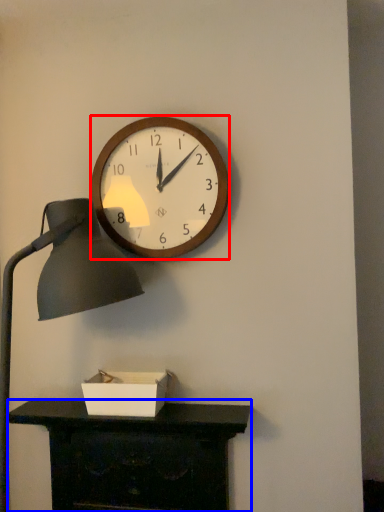
Question: Which of the following is the farthest to the observer, wall clock (highlighted by a red box) or desk (highlighted by a blue box)?

Choices:
 (A) wall clock
 (B) desk

Answer: (A)